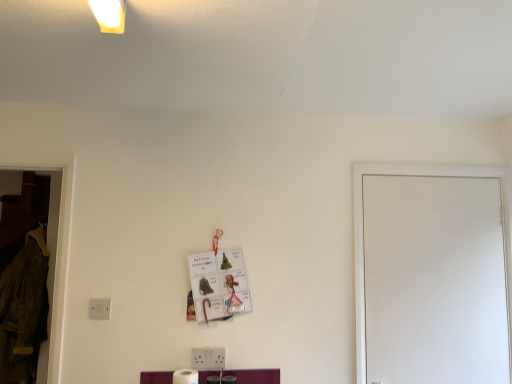
Question: Is white matte door at right not near white matte toilet paper at lower center?

Choices:
 (A) no
 (B) yes

Answer: (B)

Question: From a real-world perspective, is white matte door at right on white matte toilet paper at lower center?

Choices:
 (A) no
 (B) yes

Answer: (B)

Question: Considering the relative sizes of white matte door at right and white matte toilet paper at lower center in the image provided, is white matte door at right taller than white matte toilet paper at lower center?

Choices:
 (A) no
 (B) yes

Answer: (B)

Question: From a real-world perspective, is white matte door at right under white matte toilet paper at lower center?

Choices:
 (A) yes
 (B) no

Answer: (B)

Question: Is white matte door at right looking in the opposite direction of white matte toilet paper at lower center?

Choices:
 (A) yes
 (B) no

Answer: (B)

Question: Could white matte toilet paper at lower center be considered to be inside white matte door at right?

Choices:
 (A) yes
 (B) no

Answer: (B)

Question: Is the depth of white matte toilet paper at lower center greater than that of velvet brown coat at left?

Choices:
 (A) yes
 (B) no

Answer: (B)

Question: Does white matte toilet paper at lower center contain velvet brown coat at left?

Choices:
 (A) yes
 (B) no

Answer: (B)

Question: Is white matte toilet paper at lower center thinner than velvet brown coat at left?

Choices:
 (A) no
 (B) yes

Answer: (B)

Question: Does white matte toilet paper at lower center have a lesser height compared to velvet brown coat at left?

Choices:
 (A) no
 (B) yes

Answer: (B)

Question: Is white matte toilet paper at lower center at the right side of velvet brown coat at left?

Choices:
 (A) yes
 (B) no

Answer: (A)

Question: Is white matte toilet paper at lower center oriented away from velvet brown coat at left?

Choices:
 (A) no
 (B) yes

Answer: (A)

Question: Considering the relative sizes of velvet brown coat at left and white matte door at right in the image provided, is velvet brown coat at left shorter than white matte door at right?

Choices:
 (A) yes
 (B) no

Answer: (B)